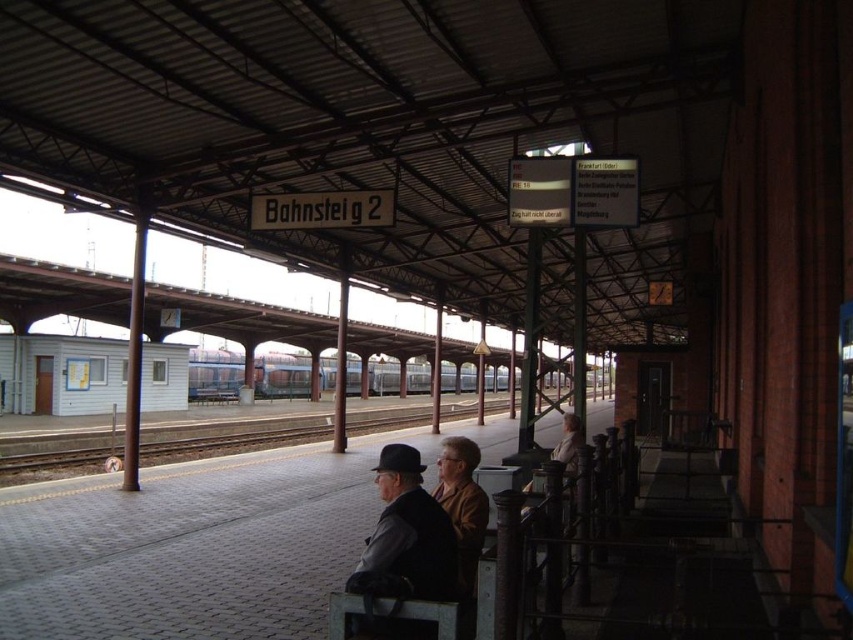
Between dark gray wool hat at center and blue metallic train at center, which one is positioned higher?

dark gray wool hat at center

Which is behind, point (367, 545) or point (428, 388)?

The point (428, 388) is more distant.

This screenshot has height=640, width=853. Identify the location of dark gray wool hat at center. (405, 536).